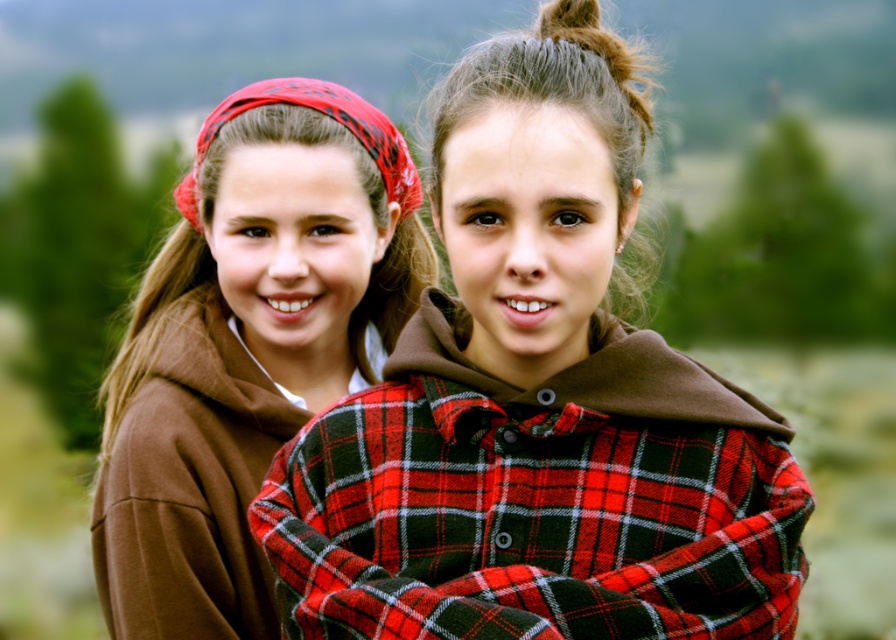
You are a photographer setting up a tripod to capture the scene. You notice the matte brown hoodie at left and the red plaid bandana at upper left. Which object should you adjust your camera angle to focus on if you want to capture the taller object?

The red plaid bandana at upper left is taller than the matte brown hoodie at left, so you should adjust your camera angle to focus on the red plaid bandana at upper left to capture the taller object.

You are a photographer trying to capture both the matte brown hoodie at left and the red plaid bandana at upper left in a single frame. Which object should you adjust your camera focus on first if you want to ensure both are in focus?

The matte brown hoodie at left is thinner than the red plaid bandana at upper left, so you should focus on the matte brown hoodie at left first to ensure both are in focus.